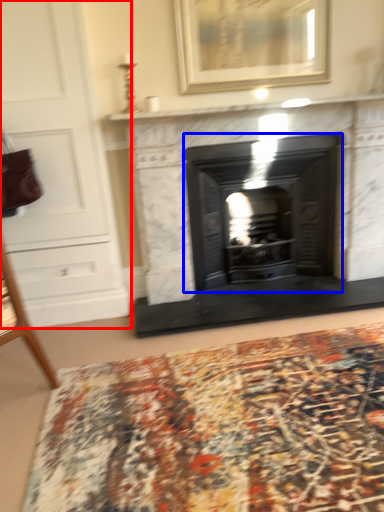
Question: Among these objects, which one is farthest to the camera, dresser (highlighted by a red box) or wood burning stove (highlighted by a blue box)?

Choices:
 (A) dresser
 (B) wood burning stove

Answer: (B)